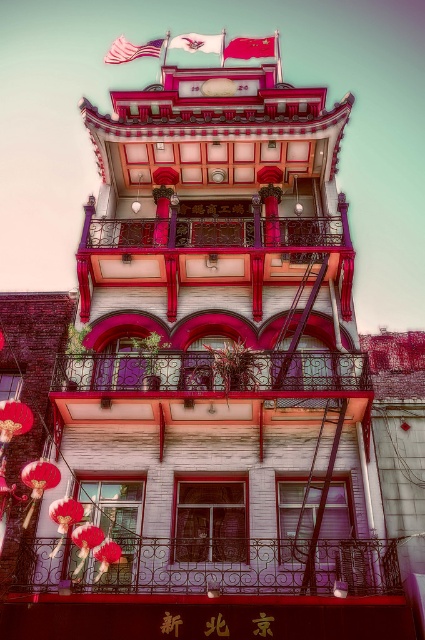
How distant is rustic wrought iron balcony at center from red fabric flag at upper center?

rustic wrought iron balcony at center is 52.52 meters from red fabric flag at upper center.

Is rustic wrought iron balcony at center positioned at the back of red fabric flag at upper center?

No, it is not.

Where is `rustic wrought iron balcony at center`? rustic wrought iron balcony at center is located at coordinates (204, 381).

Between rustic wrought iron balcony at center and metallic wrought iron balcony at center, which one appears on the right side from the viewer's perspective?

metallic wrought iron balcony at center

Between rustic wrought iron balcony at center and metallic wrought iron balcony at center, which one has less height?

With less height is metallic wrought iron balcony at center.

Is point (175, 380) farther from camera compared to point (289, 225)?

No, (175, 380) is closer to viewer.

Image resolution: width=425 pixels, height=640 pixels. Find the location of `rustic wrought iron balcony at center`. rustic wrought iron balcony at center is located at coordinates (204, 381).

What do you see at coordinates (204, 381) in the screenshot?
I see `rustic wrought iron balcony at center` at bounding box center [204, 381].

Is point (252, 385) farther from viewer compared to point (206, 45)?

No.

Is point (172, 360) farther from viewer compared to point (212, 44)?

No, (172, 360) is in front of (212, 44).

I want to click on rustic wrought iron balcony at center, so click(204, 381).